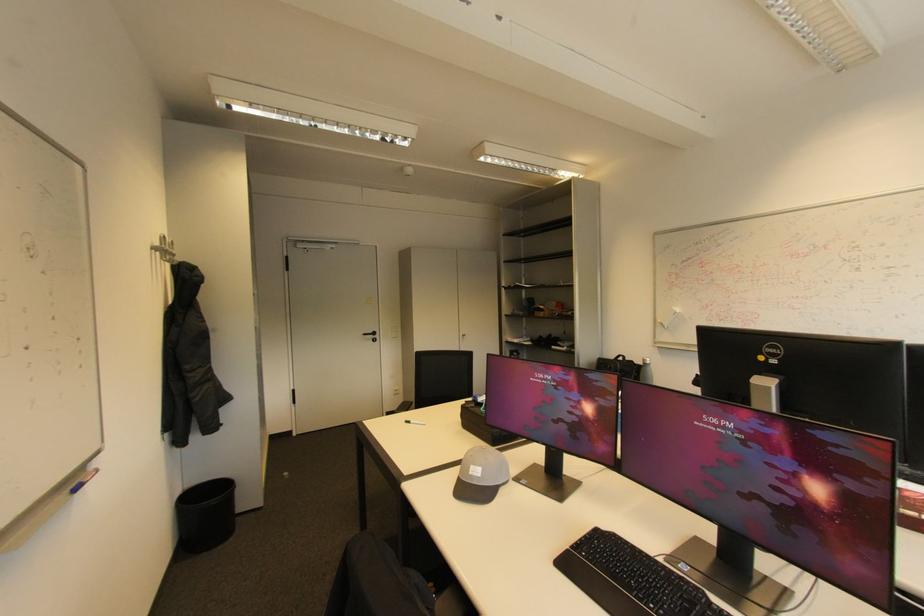
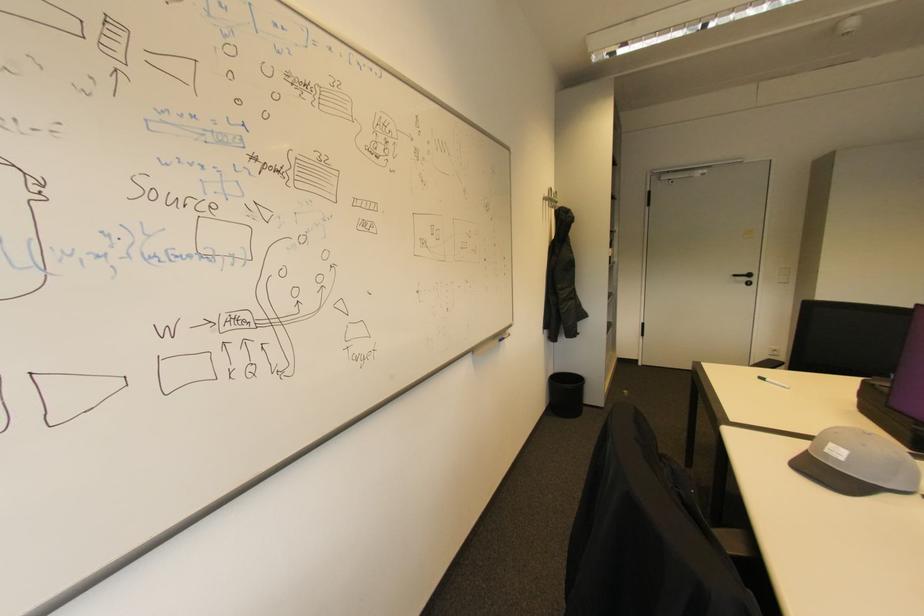
The point at [79,484] is marked in the first image. Where is the corresponding point in the second image?

(505, 338)